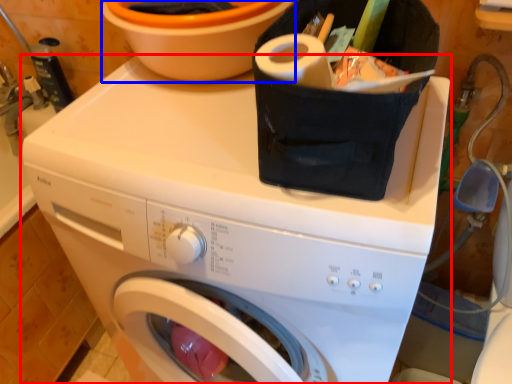
Question: Which point is closer to the camera, washing machine (highlighted by a red box) or basin (highlighted by a blue box)?

Choices:
 (A) washing machine
 (B) basin

Answer: (A)